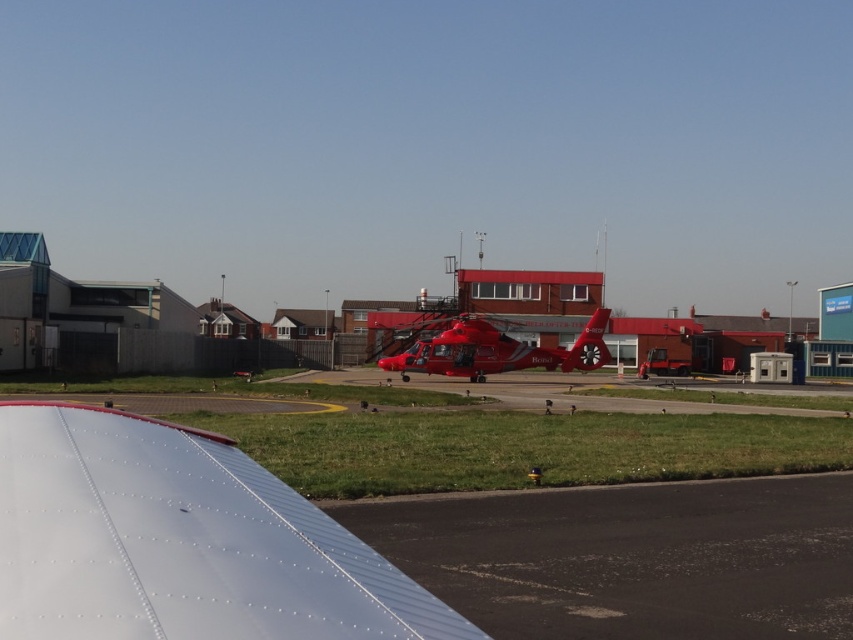
Is the position of white metallic wing at lower left less distant than that of metallic red helicopter at center?

Yes, white metallic wing at lower left is in front of metallic red helicopter at center.

Can you confirm if white metallic wing at lower left is bigger than metallic red helicopter at center?

Incorrect, white metallic wing at lower left is not larger than metallic red helicopter at center.

Does point (486, 636) come farther from viewer compared to point (454, 344)?

No, (486, 636) is in front of (454, 344).

Where is `white metallic wing at lower left`? white metallic wing at lower left is located at coordinates (178, 541).

Can you confirm if white metallic wing at lower left is positioned to the left of black asphalt runway at lower center?

Yes, white metallic wing at lower left is to the left of black asphalt runway at lower center.

Is white metallic wing at lower left positioned in front of black asphalt runway at lower center?

Yes, it is in front of black asphalt runway at lower center.

Is point (22, 595) farther from viewer compared to point (552, 516)?

No, (22, 595) is in front of (552, 516).

Where is `white metallic wing at lower left`? This screenshot has width=853, height=640. white metallic wing at lower left is located at coordinates (178, 541).

Who is higher up, black asphalt runway at lower center or metallic red helicopter at center?

Positioned higher is metallic red helicopter at center.

Which is in front, point (630, 576) or point (491, 333)?

Positioned in front is point (630, 576).

Identify the location of black asphalt runway at lower center. The height and width of the screenshot is (640, 853). point(630,557).